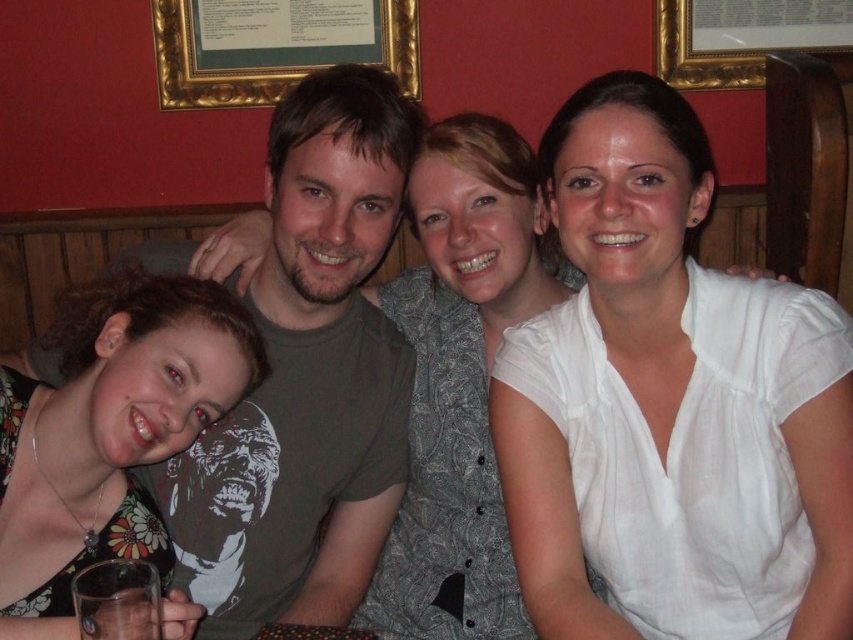
Can you confirm if white cotton blouse at center is positioned below floral print dress at lower left?

No, white cotton blouse at center is not below floral print dress at lower left.

Who is taller, white cotton blouse at center or floral print dress at lower left?

Standing taller between the two is white cotton blouse at center.

In order to click on white cotton blouse at center in this screenshot , I will do [670, 404].

Is point (392, 145) more distant than point (122, 609)?

That is True.

Does matte green t-shirt at center have a larger size compared to clear glass at lower left?

Indeed, matte green t-shirt at center has a larger size compared to clear glass at lower left.

The height and width of the screenshot is (640, 853). I want to click on matte green t-shirt at center, so click(x=306, y=380).

Where is `matte green t-shirt at center`? The height and width of the screenshot is (640, 853). matte green t-shirt at center is located at coordinates (306, 380).

Can you confirm if floral print dress at lower left is shorter than gold framed picture at upper center?

In fact, floral print dress at lower left may be taller than gold framed picture at upper center.

The image size is (853, 640). What do you see at coordinates (113, 428) in the screenshot? I see `floral print dress at lower left` at bounding box center [113, 428].

Who is more distant from viewer, (x=25, y=572) or (x=675, y=64)?

The point (x=675, y=64) is behind.

The width and height of the screenshot is (853, 640). Identify the location of floral print dress at lower left. (113, 428).